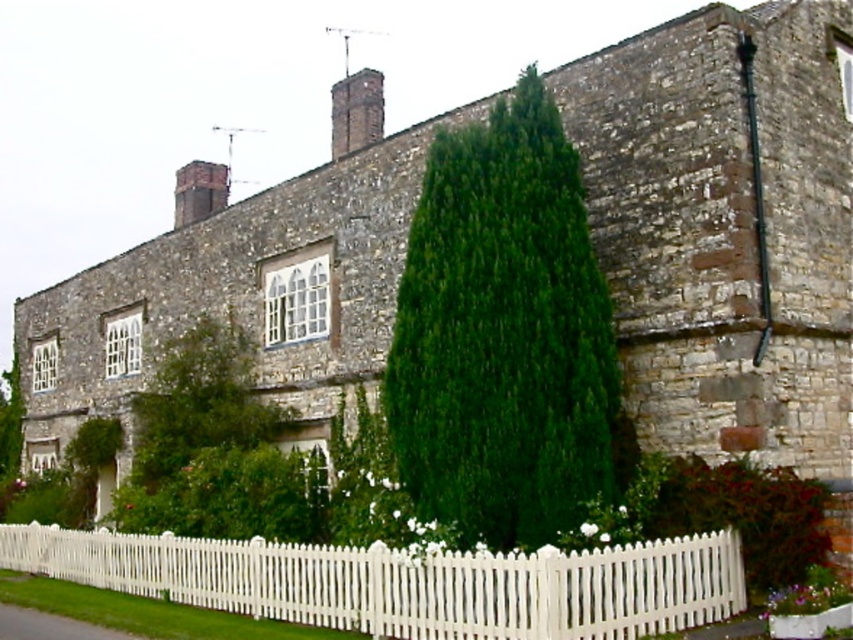
Question: Considering the real-world distances, which object is closest to the brick chimney at upper center?

Choices:
 (A) white picket fence at lower center
 (B) green leafy tree at center
 (C) green leafy tree at lower left

Answer: (B)

Question: Which of the following is the farthest from the observer?

Choices:
 (A) green leafy tree at center
 (B) white picket fence at lower center
 (C) green leafy tree at lower left

Answer: (C)

Question: Which of the following is the closest to the observer?

Choices:
 (A) red brick chimney at upper center
 (B) green leafy tree at center
 (C) white picket fence at lower center

Answer: (C)

Question: In this image, where is green leafy tree at center located relative to brick chimney at upper center?

Choices:
 (A) below
 (B) above

Answer: (A)

Question: Does brick chimney at upper center have a smaller size compared to green leafy tree at lower left?

Choices:
 (A) yes
 (B) no

Answer: (B)

Question: Is brick chimney at upper center further to the viewer compared to green leafy tree at lower left?

Choices:
 (A) yes
 (B) no

Answer: (B)